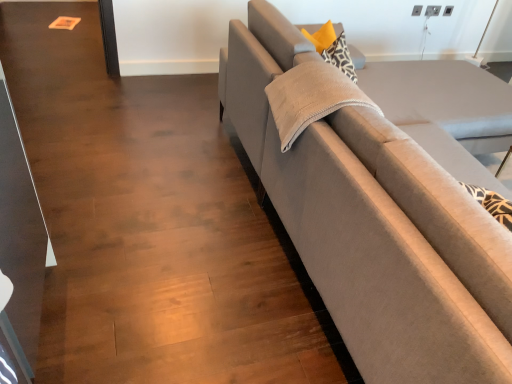
Locate an element on the screen. The image size is (512, 384). free region on the left part of light gray fabric couch at right is located at coordinates (176, 252).